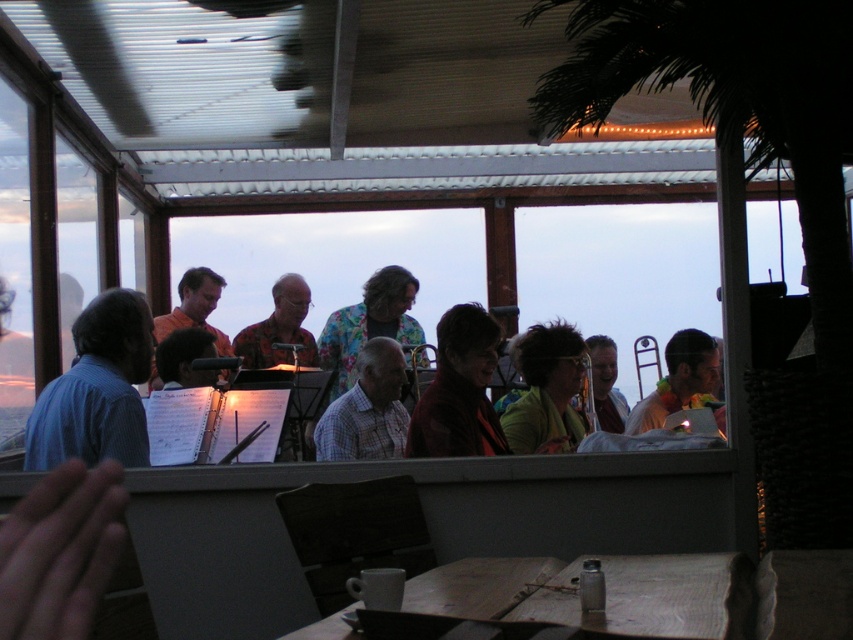
You are a photographer at the event and want to capture a photo of both the matte red jacket at center and the matte black tie at center. Since the camera can only focus on one subject at a time, which one should you focus on to ensure the other is still in the background?

The matte red jacket at center is above the matte black tie at center, so focusing on the matte red jacket at center will keep the matte black tie at center in the background.

You are standing in the center of the covered outdoor area. There is a point marked at coordinates point (459, 390). What object is located at that point?

The point (459, 390) marks the location of the matte red jacket at center.

You are organizing a charity event and need to place a small donation box between the matte red jacket at center and the matte black tie at center. Given their sizes, which object should the donation box be closer to?

The donation box should be closer to the matte black tie at center because the matte red jacket at center has a smaller size compared to matte black tie at center, so there might be more space near the larger object.